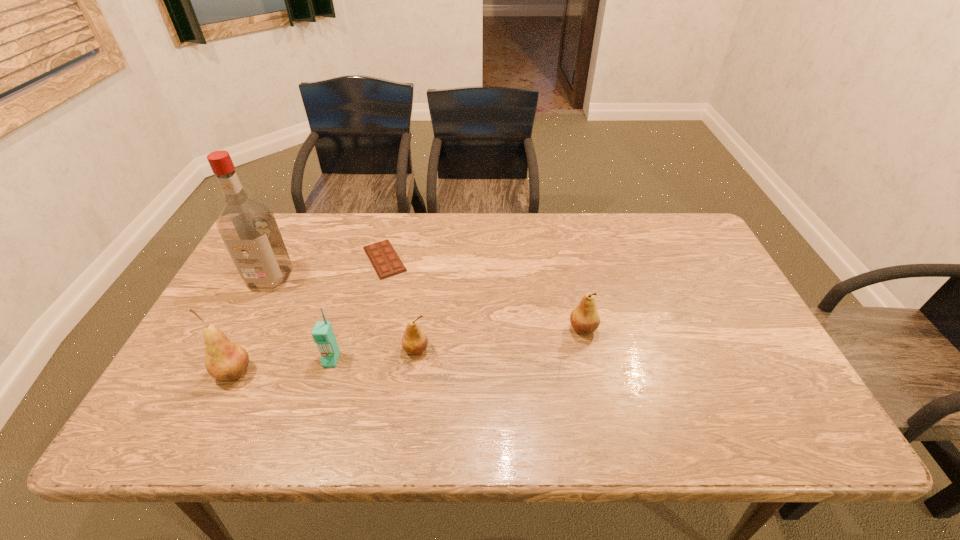
Where is `vacant point at the near edge`? vacant point at the near edge is located at coordinates (481, 403).

Where is `free region at the left edge of the desktop`? free region at the left edge of the desktop is located at coordinates (236, 334).

The image size is (960, 540). I want to click on vacant space at the right edge of the desktop, so click(x=704, y=310).

Where is `vacant space at the far left corner`? vacant space at the far left corner is located at coordinates (310, 227).

The height and width of the screenshot is (540, 960). Find the location of `vacant space at the far right corner of the desktop`. vacant space at the far right corner of the desktop is located at coordinates (694, 238).

Locate an element on the screen. Image resolution: width=960 pixels, height=540 pixels. vacant area that lies between the fifth tallest object and the tallest object is located at coordinates (x=343, y=314).

You are a GUI agent. You are given a task and a screenshot of the screen. Output one action in this format:
    pyautogui.click(x=<x>, y=<y>)
    Task: Click on the blank region between the second shortest object and the liquor
    
    Given the screenshot: What is the action you would take?
    pyautogui.click(x=343, y=314)

Identify the location of free space between the rightmost object and the chocolate bar. The height and width of the screenshot is (540, 960). (484, 294).

The height and width of the screenshot is (540, 960). Find the location of `free space between the liquor and the fifth object from left to right`. free space between the liquor and the fifth object from left to right is located at coordinates (343, 314).

The height and width of the screenshot is (540, 960). Find the location of `free space between the shortest pear and the liquor`. free space between the shortest pear and the liquor is located at coordinates (343, 314).